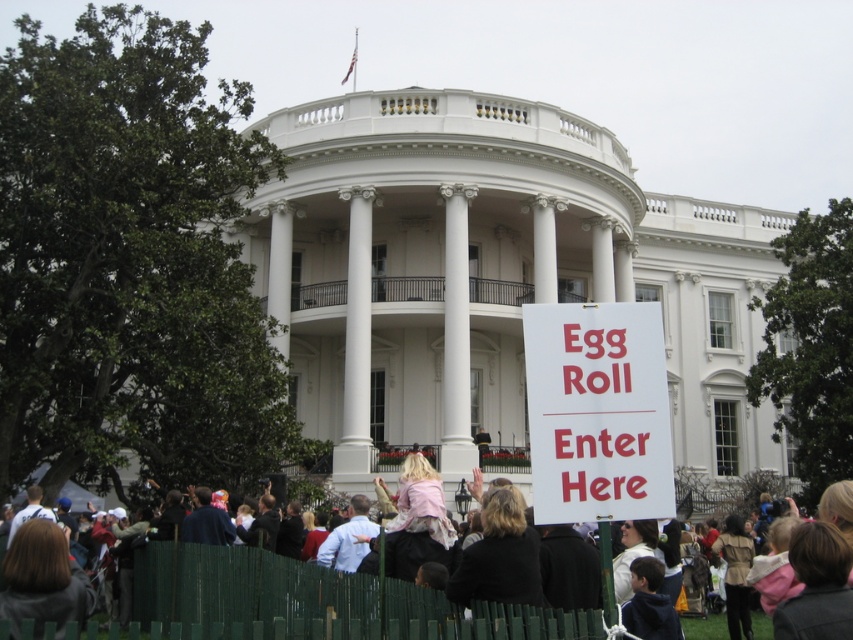
Question: Which object is farther from the camera taking this photo?

Choices:
 (A) white paper sign at center
 (B) green wooden fence at lower center
 (C) blonde hair at center

Answer: (A)

Question: Which point is closer to the camera?

Choices:
 (A) blonde hair at center
 (B) green wooden fence at lower center

Answer: (A)

Question: Does white paper sign at center come in front of blonde hair at center?

Choices:
 (A) yes
 (B) no

Answer: (B)

Question: Can you confirm if white paper sign at center is positioned above green wooden fence at lower center?

Choices:
 (A) no
 (B) yes

Answer: (B)

Question: Which of the following is the farthest from the observer?

Choices:
 (A) green wooden fence at lower center
 (B) white paper sign at center

Answer: (B)

Question: Does blonde hair at center come in front of green wooden fence at lower center?

Choices:
 (A) yes
 (B) no

Answer: (A)